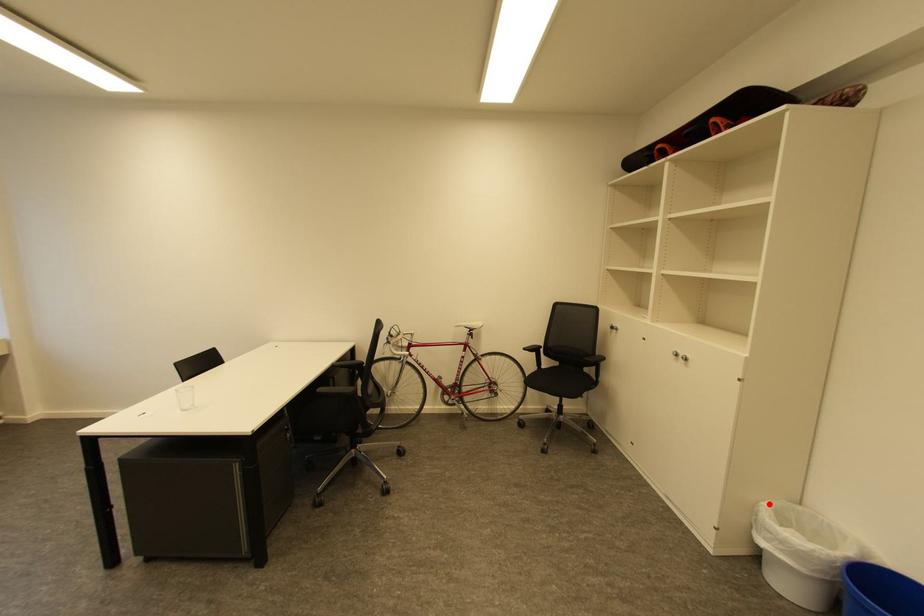
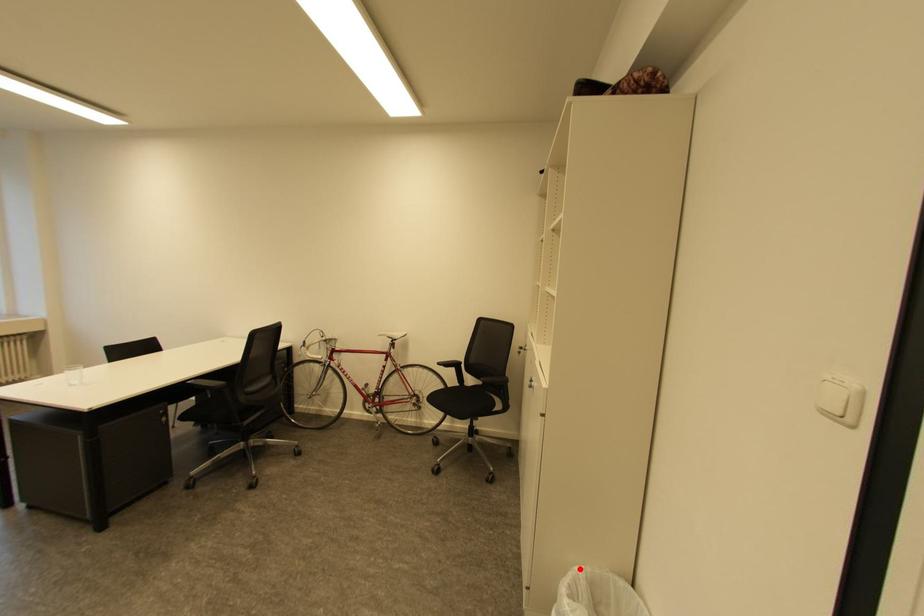
I am providing you with two images of the same scene from different viewpoints. A red point is marked on the first image and another point is marked on the second image. Is the red point in image1 aligned with the point shown in image2?

Yes